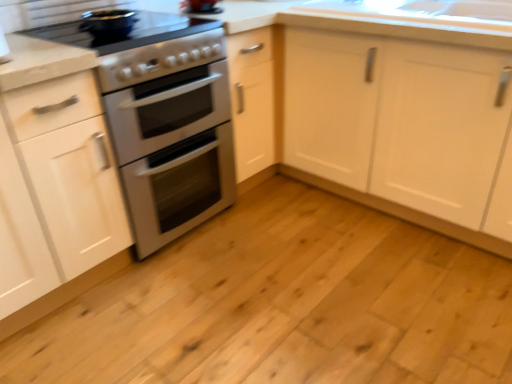
The image size is (512, 384). What do you see at coordinates (399, 120) in the screenshot?
I see `white matte cabinet at center, which is the second cabinetry from left to right` at bounding box center [399, 120].

Locate an element on the screen. satin silver oven at center, which appears as the first appliance when ordered from the bottom is located at coordinates (164, 120).

Describe the element at coordinates (59, 186) in the screenshot. This screenshot has height=384, width=512. I see `white matte cabinet at left, acting as the second cabinetry starting from the right` at that location.

How much space does white matte cabinet at left, acting as the second cabinetry starting from the right, occupy vertically?

89.63 centimeters.

This screenshot has height=384, width=512. I want to click on white matte cabinet at center, which is the second cabinetry from left to right, so click(x=399, y=120).

Is white matte cabinet at left, acting as the second cabinetry starting from the right, completely or partially outside of white matte cabinet at center, the 1th cabinetry from the right?

Yes, white matte cabinet at left, acting as the second cabinetry starting from the right, is located beyond the bounds of white matte cabinet at center, the 1th cabinetry from the right.

From a real-world perspective, which is physically above, white matte cabinet at left, acting as the second cabinetry starting from the right, or white matte cabinet at center, the 1th cabinetry from the right?

white matte cabinet at center, the 1th cabinetry from the right.

Looking at this image, is white matte cabinet at center, the 1th cabinetry from the right, at the back of white matte cabinet at left, acting as the second cabinetry starting from the right?

No, white matte cabinet at left, acting as the second cabinetry starting from the right, is not facing the opposite direction of white matte cabinet at center, the 1th cabinetry from the right.

In the scene shown: Which is more distant, (86, 133) or (438, 67)?

Positioned behind is point (438, 67).

Considering the points (358, 161) and (41, 116), which point is in front, point (358, 161) or point (41, 116)?

The point (41, 116) is in front.

Can you tell me how much white matte cabinet at center, the 1th cabinetry from the right, and white matte cabinet at left, placed as the 1th cabinetry when sorted from left to right, differ in facing direction?

The facing directions of white matte cabinet at center, the 1th cabinetry from the right, and white matte cabinet at left, placed as the 1th cabinetry when sorted from left to right, are 90 degrees apart.

Considering the positions of objects white matte cabinet at center, which is the second cabinetry from left to right, and white matte cabinet at left, acting as the second cabinetry starting from the right, in the image provided, who is more to the right, white matte cabinet at center, which is the second cabinetry from left to right, or white matte cabinet at left, acting as the second cabinetry starting from the right,?

Positioned to the right is white matte cabinet at center, which is the second cabinetry from left to right.

Can you confirm if white matte cabinet at center, which is the second cabinetry from left to right, is thinner than white matte cabinet at left, placed as the 1th cabinetry when sorted from left to right?

Indeed, white matte cabinet at center, which is the second cabinetry from left to right, has a lesser width compared to white matte cabinet at left, placed as the 1th cabinetry when sorted from left to right.

Considering the relative sizes of white matte cabinet at center, which is the second cabinetry from left to right, and satin silver oven at center, which appears as the first appliance when ordered from the bottom, in the image provided, is white matte cabinet at center, which is the second cabinetry from left to right, taller than satin silver oven at center, which appears as the first appliance when ordered from the bottom,?

In fact, white matte cabinet at center, which is the second cabinetry from left to right, may be shorter than satin silver oven at center, which appears as the first appliance when ordered from the bottom.

Based on their positions, is white matte cabinet at center, the 1th cabinetry from the right, located to the left or right of satin silver oven at center, which appears as the first appliance when ordered from the bottom?

Clearly, white matte cabinet at center, the 1th cabinetry from the right, is on the right of satin silver oven at center, which appears as the first appliance when ordered from the bottom, in the image.

Which is behind, point (306, 108) or point (47, 32)?

Positioned behind is point (306, 108).

Is natural wood floor at center a part of white matte cabinet at left, placed as the 1th cabinetry when sorted from left to right?

No.

From the image's perspective, who appears lower, white matte cabinet at left, placed as the 1th cabinetry when sorted from left to right, or natural wood floor at center?

natural wood floor at center, from the image's perspective.

Is white matte cabinet at left, placed as the 1th cabinetry when sorted from left to right, aimed at natural wood floor at center?

No, white matte cabinet at left, placed as the 1th cabinetry when sorted from left to right, does not turn towards natural wood floor at center.

Locate an element on the screen. The height and width of the screenshot is (384, 512). cabinetry on the right side of matte black pot at upper left, marked as the 1th appliance in a top-to-bottom arrangement is located at coordinates click(399, 120).

Which is behind, white matte cabinet at center, the 1th cabinetry from the right, or matte black pot at upper left, which is counted as the 2th appliance, starting from the bottom?

matte black pot at upper left, which is counted as the 2th appliance, starting from the bottom, is behind.

From the image's perspective, is white matte cabinet at center, the 1th cabinetry from the right, on top of matte black pot at upper left, which is counted as the 2th appliance, starting from the bottom?

Incorrect, from the image's perspective, white matte cabinet at center, the 1th cabinetry from the right, is lower than matte black pot at upper left, which is counted as the 2th appliance, starting from the bottom.

From a real-world perspective, is white matte cabinet at center, which is the second cabinetry from left to right, beneath matte black pot at upper left, marked as the 1th appliance in a top-to-bottom arrangement?

Correct, in the physical world, white matte cabinet at center, which is the second cabinetry from left to right, is lower than matte black pot at upper left, marked as the 1th appliance in a top-to-bottom arrangement.

Considering the sizes of objects natural wood floor at center and satin silver oven at center, which appears as the first appliance when ordered from the bottom, in the image provided, who is wider, natural wood floor at center or satin silver oven at center, which appears as the first appliance when ordered from the bottom,?

natural wood floor at center.

Looking at this image, is natural wood floor at center inside or outside of satin silver oven at center, which is the 2th appliance in top-to-bottom order?

natural wood floor at center is located beyond the bounds of satin silver oven at center, which is the 2th appliance in top-to-bottom order.

Which is in front, natural wood floor at center or satin silver oven at center, which is the 2th appliance in top-to-bottom order?

Positioned in front is natural wood floor at center.

Consider the image. From the image's perspective, would you say natural wood floor at center is shown under satin silver oven at center, which appears as the first appliance when ordered from the bottom?

Yes, from the image's perspective, natural wood floor at center is beneath satin silver oven at center, which appears as the first appliance when ordered from the bottom.

Between satin silver oven at center, which is the 2th appliance in top-to-bottom order, and white matte cabinet at left, placed as the 1th cabinetry when sorted from left to right, which one has larger width?

Wider between the two is satin silver oven at center, which is the 2th appliance in top-to-bottom order.

Considering the sizes of objects satin silver oven at center, which appears as the first appliance when ordered from the bottom, and white matte cabinet at left, placed as the 1th cabinetry when sorted from left to right, in the image provided, who is shorter, satin silver oven at center, which appears as the first appliance when ordered from the bottom, or white matte cabinet at left, placed as the 1th cabinetry when sorted from left to right,?

With less height is white matte cabinet at left, placed as the 1th cabinetry when sorted from left to right.

From a real-world perspective, does satin silver oven at center, which is the 2th appliance in top-to-bottom order, stand above white matte cabinet at left, acting as the second cabinetry starting from the right?

Indeed, from a real-world perspective, satin silver oven at center, which is the 2th appliance in top-to-bottom order, stands above white matte cabinet at left, acting as the second cabinetry starting from the right.

Is satin silver oven at center, which appears as the first appliance when ordered from the bottom, completely or partially outside of white matte cabinet at left, acting as the second cabinetry starting from the right?

Yes, satin silver oven at center, which appears as the first appliance when ordered from the bottom, is not within white matte cabinet at left, acting as the second cabinetry starting from the right.

You are a GUI agent. You are given a task and a screenshot of the screen. Output one action in this format:
    pyautogui.click(x=<x>, y=<y>)
    Task: Click on the cabinetry below the white matte cabinet at center, the 1th cabinetry from the right (from the image's perspective)
    This screenshot has height=384, width=512.
    Given the screenshot: What is the action you would take?
    coord(59,186)

At what (x,y) coordinates should I click in order to perform the action: click on cabinetry located above the white matte cabinet at left, acting as the second cabinetry starting from the right (from a real-world perspective). Please return your answer as a coordinate pair (x, y). This screenshot has width=512, height=384. Looking at the image, I should click on (399, 120).

From the image, which object appears to be farther from matte black pot at upper left, which is counted as the 2th appliance, starting from the bottom, natural wood floor at center or white matte cabinet at left, acting as the second cabinetry starting from the right?

natural wood floor at center is further to matte black pot at upper left, which is counted as the 2th appliance, starting from the bottom.

Considering their positions, is white matte cabinet at center, the 1th cabinetry from the right, positioned closer to matte black pot at upper left, marked as the 1th appliance in a top-to-bottom arrangement, than white matte cabinet at left, placed as the 1th cabinetry when sorted from left to right?

white matte cabinet at left, placed as the 1th cabinetry when sorted from left to right, is closer to matte black pot at upper left, marked as the 1th appliance in a top-to-bottom arrangement.

From the image, which object appears to be nearer to white matte cabinet at left, placed as the 1th cabinetry when sorted from left to right, matte black pot at upper left, marked as the 1th appliance in a top-to-bottom arrangement, or satin silver oven at center, which appears as the first appliance when ordered from the bottom?

Based on the image, satin silver oven at center, which appears as the first appliance when ordered from the bottom, appears to be nearer to white matte cabinet at left, placed as the 1th cabinetry when sorted from left to right.

Considering their positions, is matte black pot at upper left, marked as the 1th appliance in a top-to-bottom arrangement, positioned closer to white matte cabinet at left, acting as the second cabinetry starting from the right, than white matte cabinet at center, the 1th cabinetry from the right?

matte black pot at upper left, marked as the 1th appliance in a top-to-bottom arrangement, lies closer to white matte cabinet at left, acting as the second cabinetry starting from the right, than the other object.

From the picture: When comparing their distances from matte black pot at upper left, which is counted as the 2th appliance, starting from the bottom, does white matte cabinet at left, acting as the second cabinetry starting from the right, or satin silver oven at center, which appears as the first appliance when ordered from the bottom, seem closer?

The object closer to matte black pot at upper left, which is counted as the 2th appliance, starting from the bottom, is satin silver oven at center, which appears as the first appliance when ordered from the bottom.

From the image, which object appears to be farther from natural wood floor at center, matte black pot at upper left, marked as the 1th appliance in a top-to-bottom arrangement, or white matte cabinet at left, acting as the second cabinetry starting from the right?

matte black pot at upper left, marked as the 1th appliance in a top-to-bottom arrangement, is positioned further to the anchor natural wood floor at center.

Considering their positions, is white matte cabinet at left, placed as the 1th cabinetry when sorted from left to right, positioned further to satin silver oven at center, which appears as the first appliance when ordered from the bottom, than natural wood floor at center?

Among the two, natural wood floor at center is located further to satin silver oven at center, which appears as the first appliance when ordered from the bottom.

Considering their positions, is white matte cabinet at left, placed as the 1th cabinetry when sorted from left to right, positioned further to matte black pot at upper left, marked as the 1th appliance in a top-to-bottom arrangement, than white matte cabinet at center, which is the second cabinetry from left to right?

white matte cabinet at center, which is the second cabinetry from left to right, is further to matte black pot at upper left, marked as the 1th appliance in a top-to-bottom arrangement.

Where is `plain situated between satin silver oven at center, which is the 2th appliance in top-to-bottom order, and white matte cabinet at center, the 1th cabinetry from the right, from left to right`? The width and height of the screenshot is (512, 384). plain situated between satin silver oven at center, which is the 2th appliance in top-to-bottom order, and white matte cabinet at center, the 1th cabinetry from the right, from left to right is located at coordinates (284, 305).

At what (x,y) coordinates should I click in order to perform the action: click on plain situated between white matte cabinet at left, acting as the second cabinetry starting from the right, and white matte cabinet at center, which is the second cabinetry from left to right, from left to right. Please return your answer as a coordinate pair (x, y). Looking at the image, I should click on (284, 305).

I want to click on appliance between matte black pot at upper left, which is counted as the 2th appliance, starting from the bottom, and white matte cabinet at center, the 1th cabinetry from the right, in the horizontal direction, so click(x=164, y=120).

In order to click on appliance between matte black pot at upper left, which is counted as the 2th appliance, starting from the bottom, and natural wood floor at center from top to bottom in this screenshot , I will do `click(164, 120)`.